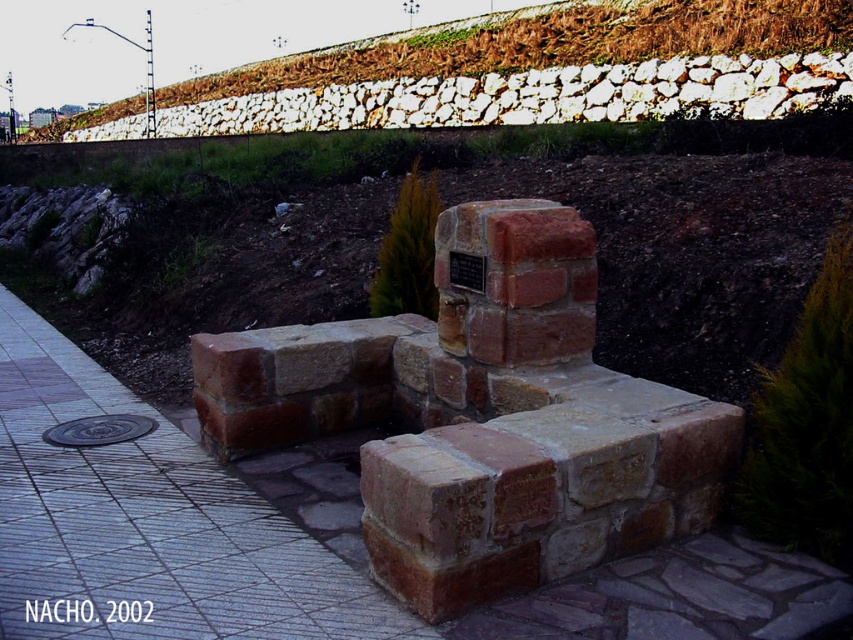
You are standing at point (845, 28) and want to walk to the monument. Is the point (16, 472) between you and the monument?

Yes, the point (16, 472) is between you and the monument because it is in front of point (845, 28), which is your current position.

You are standing at the point marked as point [12,579], which is 3.10 meters away from you. You want to place a 2.5 meter long bench along the paved walkway. Can you fit it there?

The point [12,579] is 3.10 meters away from you. Since the bench is 2.5 meters long, it can fit within the available space as 2.5 meters is less than 3.10 meters.